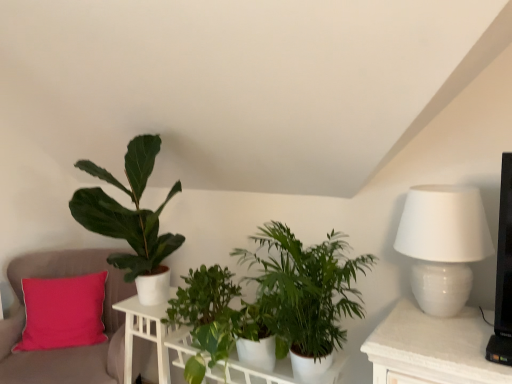
The width and height of the screenshot is (512, 384). In order to click on white glossy shelf at center in this screenshot , I will do `click(271, 372)`.

Describe the element at coordinates (71, 347) in the screenshot. I see `pink fabric cushion at left` at that location.

Where is `green matte plant at left, the first houseplant from the left`? This screenshot has height=384, width=512. green matte plant at left, the first houseplant from the left is located at coordinates (131, 220).

Locate an element on the screen. The image size is (512, 384). white glossy table lamp at right is located at coordinates (443, 244).

Identify the location of green matte plant at center, the third houseplant when ordered from left to right. This screenshot has width=512, height=384. (305, 293).

From the image's perspective, which is above, pink fabric cushion at left or green matte plant at left, the first houseplant from the left?

green matte plant at left, the first houseplant from the left.

Is the position of pink fabric cushion at left more distant than that of green matte plant at left, the first houseplant from the left?

Yes, pink fabric cushion at left is further from the camera.

Could green matte plant at left, the third houseplant viewed from the right, be considered to be inside pink fabric cushion at left?

Actually, green matte plant at left, the third houseplant viewed from the right, is outside pink fabric cushion at left.

Is green matte plant at center, which is the 1th houseplant in right-to-left order, oriented towards white wood table at lower left, which is the 2th table from right to left?

No, green matte plant at center, which is the 1th houseplant in right-to-left order, is not facing towards white wood table at lower left, which is the 2th table from right to left.

Is green matte plant at center, which is the 1th houseplant in right-to-left order, wider than white wood table at lower left, which is the 2th table from right to left?

Yes.

Would you say green matte plant at center, the third houseplant when ordered from left to right, is a long distance from white wood table at lower left, placed as the first table when sorted from left to right?

No, green matte plant at center, the third houseplant when ordered from left to right, is not far away from white wood table at lower left, placed as the first table when sorted from left to right.

Is the depth of white glossy shelf at center less than that of white glossy table lamp at right?

No, the depth of white glossy shelf at center is greater than that of white glossy table lamp at right.

From the image's perspective, is white glossy shelf at center located above or below white glossy table lamp at right?

white glossy shelf at center is situated lower than white glossy table lamp at right in the image.

Based on the photo, can you confirm if white glossy shelf at center is shorter than white glossy table lamp at right?

Yes, white glossy shelf at center is shorter than white glossy table lamp at right.

Considering the relative sizes of white glossy shelf at center and white glossy table lamp at right in the image provided, is white glossy shelf at center wider than white glossy table lamp at right?

Yes, white glossy shelf at center is wider than white glossy table lamp at right.

Does point (130, 334) appear closer or farther from the camera than point (334, 379)?

Point (130, 334) is farther from the camera than point (334, 379).

Locate an element on the screen. The width and height of the screenshot is (512, 384). table above the white wood table at lower left, placed as the first table when sorted from left to right (from a real-world perspective) is located at coordinates (152, 336).

Does white wood table at lower left, which is the 2th table from right to left, turn towards white glossy table at center, which is the 2th table from left to right?

No.

Is green matte plant at center, which is the second houseplant from left to right, in front of white glossy table lamp at right?

No, green matte plant at center, which is the second houseplant from left to right, is further to the viewer.

From a real-world perspective, who is located lower, green matte plant at center, which is the second houseplant from left to right, or white glossy table lamp at right?

→ In real-world perspective, green matte plant at center, which is the second houseplant from left to right, is lower.

Does green matte plant at center, marked as the 2th houseplant in a right-to-left arrangement, have a greater width compared to white glossy table lamp at right?

Indeed, green matte plant at center, marked as the 2th houseplant in a right-to-left arrangement, has a greater width compared to white glossy table lamp at right.

How far apart are green matte plant at center, marked as the 2th houseplant in a right-to-left arrangement, and white glossy table lamp at right?

A distance of 34.59 inches exists between green matte plant at center, marked as the 2th houseplant in a right-to-left arrangement, and white glossy table lamp at right.

Which object is thinner, green matte plant at left, the first houseplant from the left, or green matte plant at center, the third houseplant when ordered from left to right?

Thinner between the two is green matte plant at left, the first houseplant from the left.

Is green matte plant at left, the first houseplant from the left, aimed at green matte plant at center, the third houseplant when ordered from left to right?

No, green matte plant at left, the first houseplant from the left, is not aimed at green matte plant at center, the third houseplant when ordered from left to right.

Is point (149, 149) closer to camera compared to point (313, 310)?

No, it is not.

Is there a large distance between green matte plant at left, the first houseplant from the left, and green matte plant at center, which is the 1th houseplant in right-to-left order?

They are positioned close to each other.

Does green matte plant at center, the third houseplant when ordered from left to right, turn towards green matte plant at left, the first houseplant from the left?

No.

Considering the positions of points (282, 229) and (148, 177), is point (282, 229) closer to camera compared to point (148, 177)?

Yes.

Can you confirm if green matte plant at center, which is the 1th houseplant in right-to-left order, is thinner than green matte plant at left, the first houseplant from the left?

No, green matte plant at center, which is the 1th houseplant in right-to-left order, is not thinner than green matte plant at left, the first houseplant from the left.

In the scene shown: From the image's perspective, is green matte plant at center, which is the 1th houseplant in right-to-left order, located beneath green matte plant at left, the third houseplant viewed from the right?

Yes, from the image's perspective, green matte plant at center, which is the 1th houseplant in right-to-left order, is beneath green matte plant at left, the third houseplant viewed from the right.

This screenshot has height=384, width=512. What are the coordinates of `the 3rd houseplant located above the pink fabric cushion at left (from a real-world perspective)` in the screenshot? It's located at (131, 220).

Where is `table that is the 2nd one when counting backward from the green matte plant at center, the third houseplant when ordered from left to right`? table that is the 2nd one when counting backward from the green matte plant at center, the third houseplant when ordered from left to right is located at coordinates (145, 334).

Based on their spatial positions, is white glossy shelf at center or white glossy table at center, acting as the 1th table starting from the right, further from green matte plant at center, marked as the 2th houseplant in a right-to-left arrangement?

The object further to green matte plant at center, marked as the 2th houseplant in a right-to-left arrangement, is white glossy shelf at center.

Looking at the image, which one is located further to white glossy table at center, acting as the 1th table starting from the right, white glossy table lamp at right or pink fabric cushion at left?

Among the two, white glossy table lamp at right is located further to white glossy table at center, acting as the 1th table starting from the right.

Considering their positions, is white glossy table at center, which is the 2th table from left to right, positioned closer to green matte plant at center, the third houseplant when ordered from left to right, than pink fabric cushion at left?

white glossy table at center, which is the 2th table from left to right, is closer to green matte plant at center, the third houseplant when ordered from left to right.

In the scene shown: Looking at the image, which one is located closer to white glossy table lamp at right, white glossy shelf at center or white glossy table at center, which is the 2th table from left to right?

Among the two, white glossy shelf at center is located nearer to white glossy table lamp at right.

Which object lies further to the anchor point white glossy table lamp at right, white glossy table at center, acting as the 1th table starting from the right, or green matte plant at center, marked as the 2th houseplant in a right-to-left arrangement?

white glossy table at center, acting as the 1th table starting from the right, is positioned further to the anchor white glossy table lamp at right.

Estimate the real-world distances between objects in this image. Which object is closer to white glossy shelf at center, white glossy table at center, which is the 2th table from left to right, or green matte plant at left, the third houseplant viewed from the right?

white glossy table at center, which is the 2th table from left to right, lies closer to white glossy shelf at center than the other object.

When comparing their distances from white glossy table at center, which is the 2th table from left to right, does white glossy table lamp at right or green matte plant at center, which is the 1th houseplant in right-to-left order, seem closer?

green matte plant at center, which is the 1th houseplant in right-to-left order.

Looking at the image, which one is located further to green matte plant at center, marked as the 2th houseplant in a right-to-left arrangement, white glossy table at center, acting as the 1th table starting from the right, or white wood table at lower left, placed as the first table when sorted from left to right?

white wood table at lower left, placed as the first table when sorted from left to right, lies further to green matte plant at center, marked as the 2th houseplant in a right-to-left arrangement, than the other object.

I want to click on table situated between white wood table at lower left, placed as the first table when sorted from left to right, and white glossy table lamp at right from left to right, so click(x=152, y=336).

Locate an element on the screen. The width and height of the screenshot is (512, 384). houseplant located between green matte plant at center, which is the second houseplant from left to right, and white glossy table lamp at right in the left-right direction is located at coordinates (305, 293).

At what (x,y) coordinates should I click in order to perform the action: click on shelf situated between green matte plant at center, which is the second houseplant from left to right, and white glossy table lamp at right from left to right. Please return your answer as a coordinate pair (x, y). The width and height of the screenshot is (512, 384). Looking at the image, I should click on (271, 372).

Locate an element on the screen. shelf situated between pink fabric cushion at left and green matte plant at center, the third houseplant when ordered from left to right, from left to right is located at coordinates (271, 372).